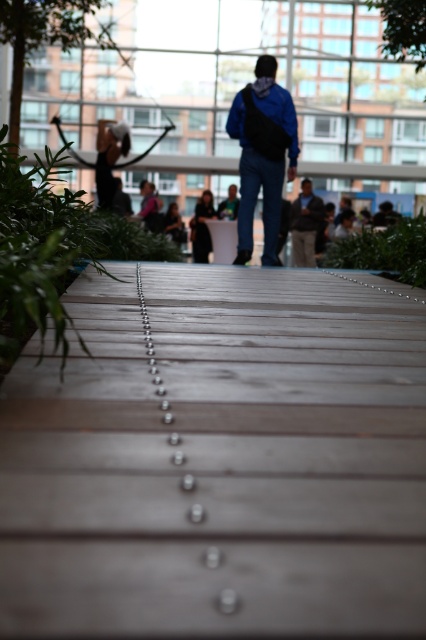
Between wooden planks at center and green leafy plant at left, which one is positioned lower?

wooden planks at center is below.

Which of these two, wooden planks at center or green leafy plant at left, stands shorter?

wooden planks at center is shorter.

This screenshot has width=426, height=640. Describe the element at coordinates (218, 460) in the screenshot. I see `wooden planks at center` at that location.

Find the location of a particular element. This screenshot has width=426, height=640. wooden planks at center is located at coordinates (218, 460).

Who is lower down, green leafy plant at left or green leafy plant at center?

Positioned lower is green leafy plant at left.

Consider the image. Can you confirm if green leafy plant at left is thinner than green leafy plant at center?

Yes.

The width and height of the screenshot is (426, 640). What are the coordinates of `green leafy plant at left` in the screenshot? It's located at (39, 252).

Who is more forward, (0, 346) or (307, 260)?

Point (0, 346) is in front.

Does point (37, 218) come in front of point (293, 204)?

Yes.

In order to click on green leafy plant at left in this screenshot , I will do `click(39, 252)`.